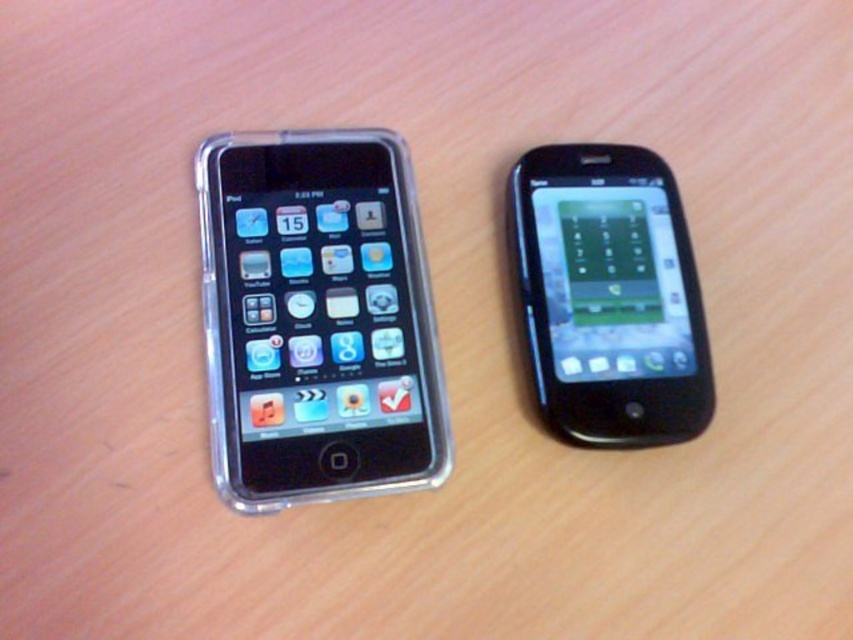
Does clear plastic phone at left have a larger size compared to black glossy smartphone at right?

Correct, clear plastic phone at left is larger in size than black glossy smartphone at right.

From the picture: Is clear plastic phone at left below black glossy smartphone at right?

Yes, clear plastic phone at left is below black glossy smartphone at right.

Which is behind, point (308, 252) or point (645, 408)?

Point (308, 252)

The height and width of the screenshot is (640, 853). I want to click on clear plastic phone at left, so click(317, 320).